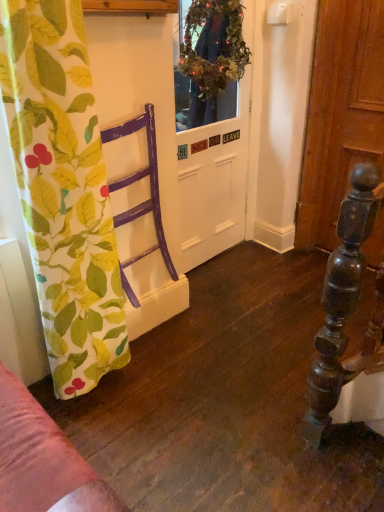
Describe the element at coordinates (63, 190) in the screenshot. I see `printed fabric curtain at left` at that location.

Where is `green leafy wreath at upper center`? This screenshot has height=512, width=384. green leafy wreath at upper center is located at coordinates (219, 47).

Find the location of a particular element. purple wood chair at left is located at coordinates (145, 201).

Considering the sizes of objects printed fabric curtain at left and purple wood chair at left in the image provided, who is smaller, printed fabric curtain at left or purple wood chair at left?

purple wood chair at left is smaller.

Is printed fabric curtain at left further to camera compared to purple wood chair at left?

No, it is not.

Who is taller, printed fabric curtain at left or purple wood chair at left?

printed fabric curtain at left.

Is point (39, 85) closer to camera compared to point (174, 280)?

Yes.

How much distance is there between printed fabric curtain at left and white matte door at center?

printed fabric curtain at left is 1.13 meters away from white matte door at center.

Is white matte door at center at the back of printed fabric curtain at left?

No, printed fabric curtain at left is not facing away from white matte door at center.

From a real-world perspective, is printed fabric curtain at left positioned over white matte door at center based on gravity?

No.

Do you think printed fabric curtain at left is within white matte door at center, or outside of it?

printed fabric curtain at left lies outside white matte door at center.

Considering the relative sizes of purple wood chair at left and green leafy wreath at upper center in the image provided, is purple wood chair at left bigger than green leafy wreath at upper center?

Yes, purple wood chair at left is bigger than green leafy wreath at upper center.

Is there a large distance between purple wood chair at left and green leafy wreath at upper center?

purple wood chair at left is actually quite close to green leafy wreath at upper center.

Identify the location of armchair below the green leafy wreath at upper center (from a real-world perspective). This screenshot has height=512, width=384. (145, 201).

Is white matte door at center positioned beyond the bounds of green leafy wreath at upper center?

Indeed, white matte door at center is completely outside green leafy wreath at upper center.

What's the angular difference between white matte door at center and green leafy wreath at upper center's facing directions?

A: 2.05 degrees separate the facing orientations of white matte door at center and green leafy wreath at upper center.

Between white matte door at center and green leafy wreath at upper center, which one appears on the right side from the viewer's perspective?

green leafy wreath at upper center is more to the right.

Which of these two, white matte door at center or green leafy wreath at upper center, is thinner?

Thinner between the two is white matte door at center.

Which is less distant, (204, 168) or (105, 135)?

The point (105, 135) is more forward.

At what (x,y) coordinates should I click in order to perform the action: click on armchair in front of the white matte door at center. Please return your answer as a coordinate pair (x, y). Image resolution: width=384 pixels, height=512 pixels. Looking at the image, I should click on (145, 201).

Who is bigger, white matte door at center or purple wood chair at left?

white matte door at center.

Would you say white matte door at center is a long distance from purple wood chair at left?

No, there isn't a large distance between white matte door at center and purple wood chair at left.

From the image's perspective, relative to white matte door at center, is green leafy wreath at upper center above or below?

green leafy wreath at upper center is above white matte door at center.

From a real-world perspective, is green leafy wreath at upper center under white matte door at center?

Incorrect, from a real-world perspective, green leafy wreath at upper center is higher than white matte door at center.

How different are the orientations of green leafy wreath at upper center and white matte door at center in degrees?

The facing directions of green leafy wreath at upper center and white matte door at center are 2.05 degrees apart.

Is green leafy wreath at upper center next to purple wood chair at left and touching it?

No, green leafy wreath at upper center is not with purple wood chair at left.

Is point (244, 69) less distant than point (163, 252)?

No.

Does green leafy wreath at upper center have a greater width compared to purple wood chair at left?

In fact, green leafy wreath at upper center might be narrower than purple wood chair at left.

Identify the location of armchair behind the printed fabric curtain at left. (145, 201).

Locate an element on the screen. Image resolution: width=384 pixels, height=512 pixels. door on the right of printed fabric curtain at left is located at coordinates (x=213, y=168).

From the picture: From the image, which object appears to be nearer to printed fabric curtain at left, white matte door at center or green leafy wreath at upper center?

white matte door at center is closer to printed fabric curtain at left.

From the picture: Estimate the real-world distances between objects in this image. Which object is further from white matte door at center, green leafy wreath at upper center or purple wood chair at left?

purple wood chair at left lies further to white matte door at center than the other object.

Which object lies nearer to the anchor point purple wood chair at left, printed fabric curtain at left or green leafy wreath at upper center?

printed fabric curtain at left is positioned closer to the anchor purple wood chair at left.

From the image, which object appears to be farther from green leafy wreath at upper center, purple wood chair at left or white matte door at center?

purple wood chair at left is further to green leafy wreath at upper center.

Looking at this image, from the image, which object appears to be nearer to printed fabric curtain at left, white matte door at center or purple wood chair at left?

purple wood chair at left.

Estimate the real-world distances between objects in this image. Which object is closer to white matte door at center, purple wood chair at left or green leafy wreath at upper center?

green leafy wreath at upper center.

Consider the image. When comparing their distances from printed fabric curtain at left, does green leafy wreath at upper center or purple wood chair at left seem further?

The object further to printed fabric curtain at left is green leafy wreath at upper center.

Considering their positions, is printed fabric curtain at left positioned closer to green leafy wreath at upper center than purple wood chair at left?

Among the two, purple wood chair at left is located nearer to green leafy wreath at upper center.

Where is `floral arrangement positioned between printed fabric curtain at left and white matte door at center from near to far`? floral arrangement positioned between printed fabric curtain at left and white matte door at center from near to far is located at coordinates (219, 47).

Where is `armchair between green leafy wreath at upper center and printed fabric curtain at left in the vertical direction`? armchair between green leafy wreath at upper center and printed fabric curtain at left in the vertical direction is located at coordinates 145,201.

Identify the location of door between green leafy wreath at upper center and purple wood chair at left in the vertical direction. The height and width of the screenshot is (512, 384). (213, 168).

Where is `armchair between printed fabric curtain at left and white matte door at center along the z-axis`? This screenshot has height=512, width=384. armchair between printed fabric curtain at left and white matte door at center along the z-axis is located at coordinates (145, 201).